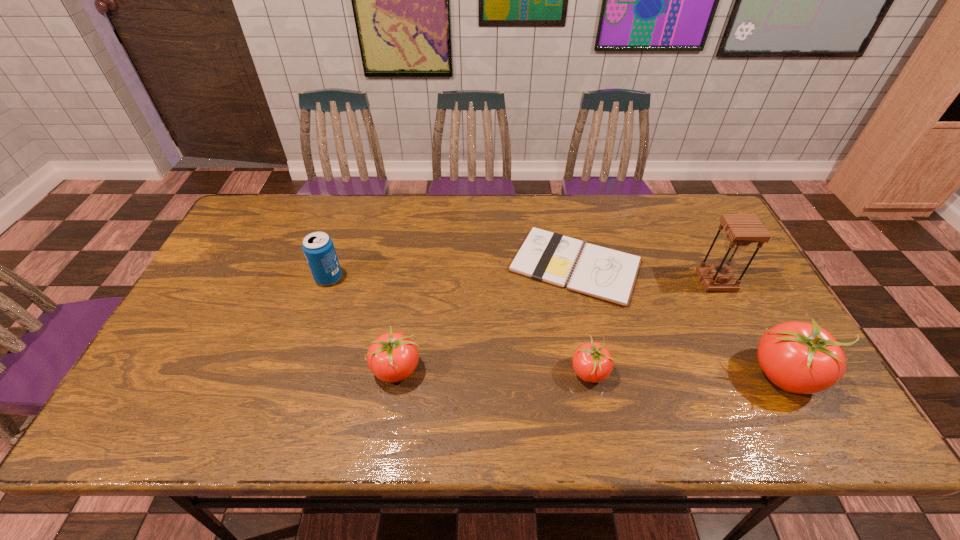
Find the location of a particular element. vacant region at the right edge of the desktop is located at coordinates (712, 306).

This screenshot has height=540, width=960. Identify the location of vacant area at the far left corner. (265, 201).

Where is `vacant space in between the hourglass and the tallest tomato`? This screenshot has height=540, width=960. vacant space in between the hourglass and the tallest tomato is located at coordinates (751, 328).

The image size is (960, 540). What are the coordinates of `vacant space that is in between the second tomato from left to right and the second tallest tomato` in the screenshot? It's located at (492, 371).

The image size is (960, 540). What are the coordinates of `free space between the second tomato from right to left and the notepad` in the screenshot? It's located at (582, 319).

Locate an element on the screen. This screenshot has height=540, width=960. free space between the soda can and the tallest tomato is located at coordinates (557, 326).

The image size is (960, 540). In order to click on free spot between the second tomato from left to right and the rightmost tomato in this screenshot , I will do `click(687, 373)`.

The width and height of the screenshot is (960, 540). I want to click on vacant region between the hourglass and the leftmost object, so click(522, 280).

Locate an element on the screen. The width and height of the screenshot is (960, 540). vacant area that lies between the leftmost tomato and the leftmost object is located at coordinates (362, 323).

Locate an element on the screen. The height and width of the screenshot is (540, 960). vacant area that lies between the soda can and the leftmost tomato is located at coordinates (362, 323).